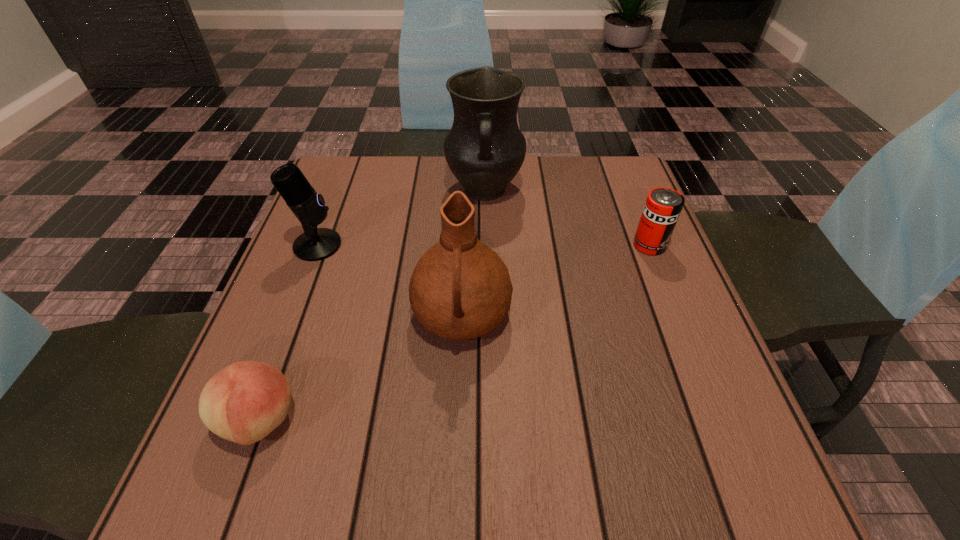
What are the coordinates of `free spot located on the left of the can` in the screenshot? It's located at (594, 245).

The image size is (960, 540). I want to click on vacant space located on the back of the shortest object, so click(x=287, y=343).

Locate an element on the screen. Image resolution: width=960 pixels, height=540 pixels. object present at the far edge is located at coordinates (484, 149).

Where is `object present at the near edge`? The width and height of the screenshot is (960, 540). object present at the near edge is located at coordinates (244, 402).

The height and width of the screenshot is (540, 960). What are the coordinates of `microphone that is positioned at the left edge` in the screenshot? It's located at pyautogui.click(x=315, y=244).

Identify the location of peach that is at the left edge. (244, 402).

The width and height of the screenshot is (960, 540). Identify the location of object at the right edge. (663, 206).

You are a GUI agent. You are given a task and a screenshot of the screen. Output one action in this format:
    pyautogui.click(x=<x>, y=<y>)
    Task: Click on the object located at the near left corner
    
    Given the screenshot: What is the action you would take?
    pyautogui.click(x=244, y=402)

This screenshot has width=960, height=540. Identify the location of free space at the far edge of the desktop. (452, 182).

This screenshot has height=540, width=960. What are the coordinates of `vacant space at the near edge` in the screenshot? It's located at (444, 473).